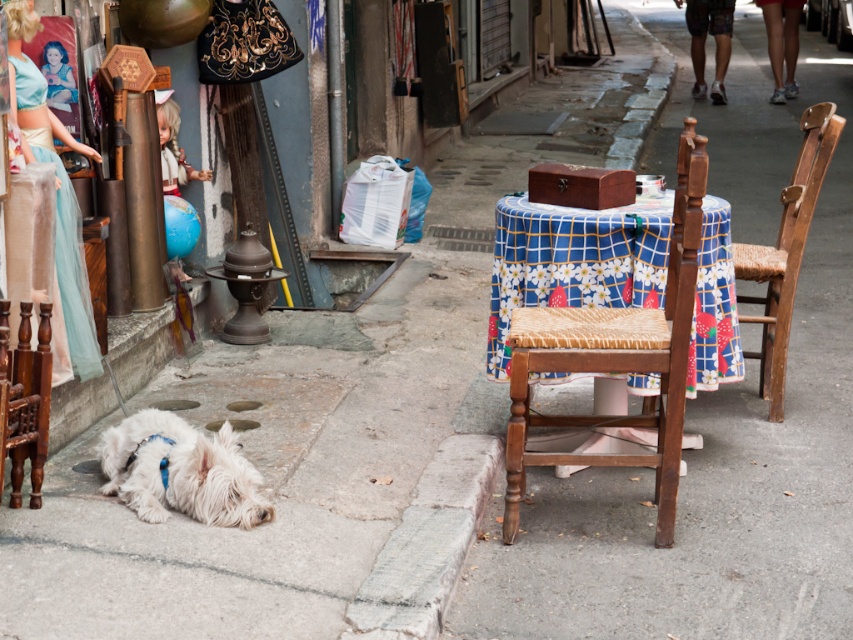
Based on the scene description, where is the smooth concrete pavement at lower center located in terms of its 2D coordinates?

The smooth concrete pavement at lower center is located at the 2D coordinates of point (712, 420).

You are a delivery person with a 1.2 meter wide cart. You need to pass through the space between the smooth concrete pavement at lower center and the woven wood chair at center. Can your cart fit through the space?

The smooth concrete pavement at lower center is wider than the woven wood chair at center. However, the description only states their widths relative to each other, not the exact measurements. Without knowing the actual width of the space between them, it is impossible to determine if the 1.2 meter wide cart can fit through the space.

Where is the white fluffy dog at lower left located in the image?

The white fluffy dog at lower left is located at point [181,472] in the image.